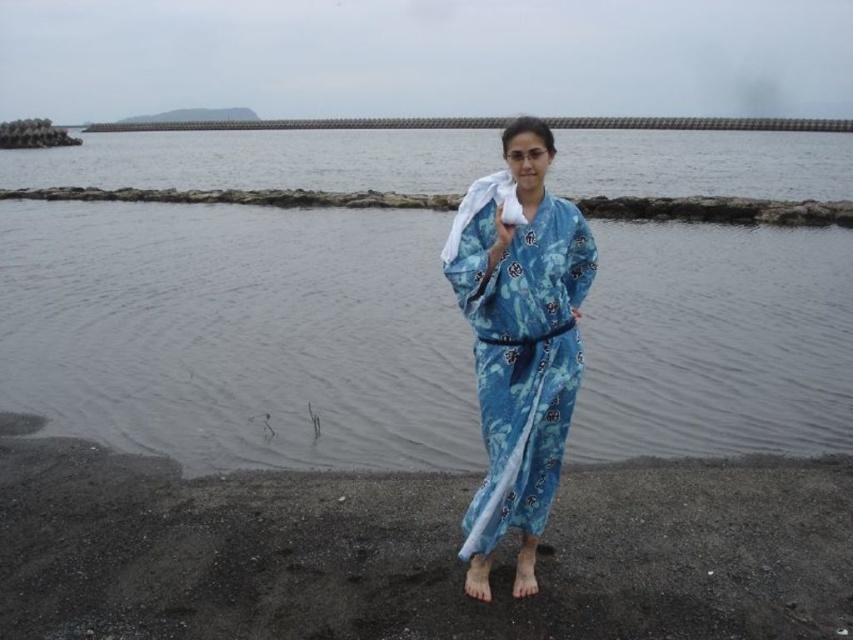
Is point (432, 253) in front of point (508, 339)?

No, (432, 253) is behind (508, 339).

Based on the photo, can you confirm if clear water at center is positioned to the left of blue floral kimono at center?

Indeed, clear water at center is positioned on the left side of blue floral kimono at center.

You are a GUI agent. You are given a task and a screenshot of the screen. Output one action in this format:
    pyautogui.click(x=<x>, y=<y>)
    Task: Click on the clear water at center
    This screenshot has width=853, height=640.
    Given the screenshot: What is the action you would take?
    pyautogui.click(x=236, y=332)

Between black sand at lower center and blue floral kimono at center, which one appears on the left side from the viewer's perspective?

black sand at lower center

Does black sand at lower center have a greater height compared to blue floral kimono at center?

In fact, black sand at lower center may be shorter than blue floral kimono at center.

Find the location of a particular element. The height and width of the screenshot is (640, 853). black sand at lower center is located at coordinates (412, 552).

This screenshot has height=640, width=853. Identify the location of black sand at lower center. (412, 552).

Who is higher up, clear water at center or black sand at lower center?

Positioned higher is clear water at center.

Does clear water at center come in front of black sand at lower center?

That is False.

The width and height of the screenshot is (853, 640). What do you see at coordinates (236, 332) in the screenshot?
I see `clear water at center` at bounding box center [236, 332].

This screenshot has height=640, width=853. What are the coordinates of `clear water at center` in the screenshot? It's located at (236, 332).